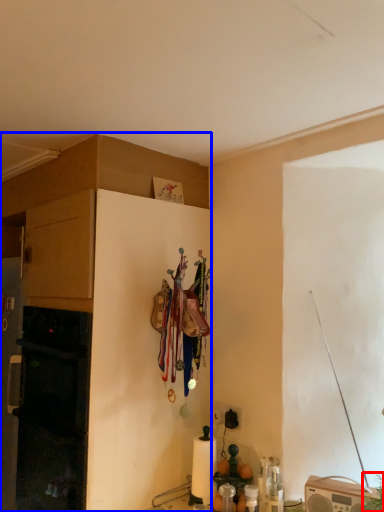
Question: Which object appears closest to the camera in this image, plant (highlighted by a red box) or cabinetry (highlighted by a blue box)?

Choices:
 (A) plant
 (B) cabinetry

Answer: (A)